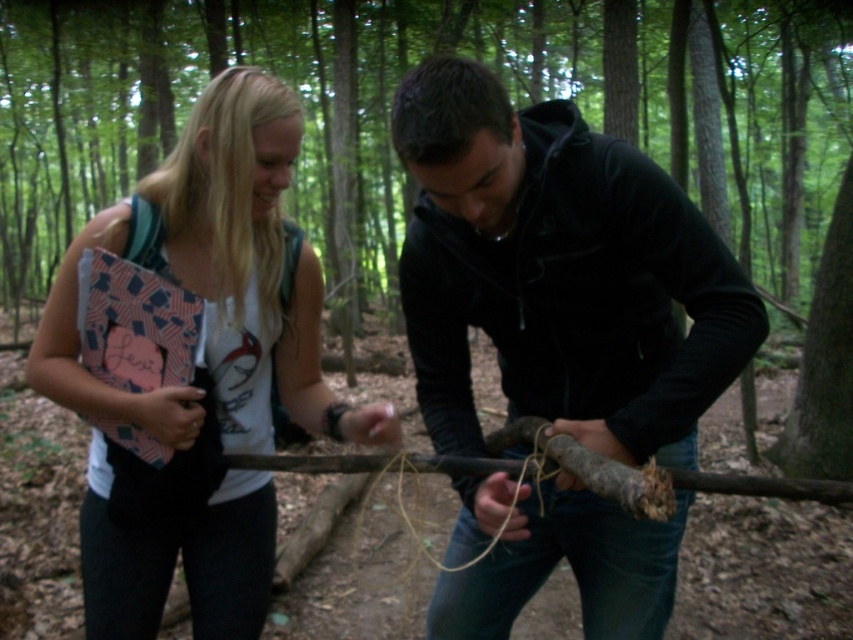
You are trying to determine which object is taller between the brown wood log at center and the matte pink notebook at left. Based on the scene, which one is taller?

The brown wood log at center is taller than the matte pink notebook at left.